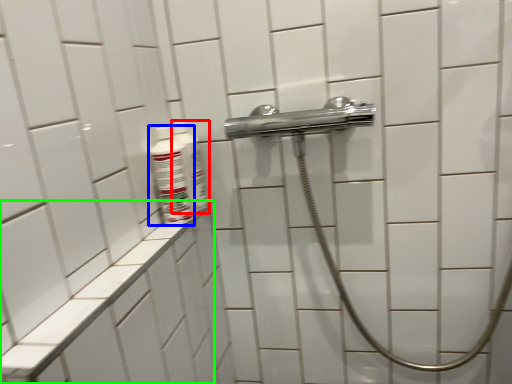
Question: Considering the real-world distances, which object is farthest from mouthwash (highlighted by a red box)? mouthwash (highlighted by a blue box) or ledge (highlighted by a green box)?

Choices:
 (A) mouthwash
 (B) ledge

Answer: (B)